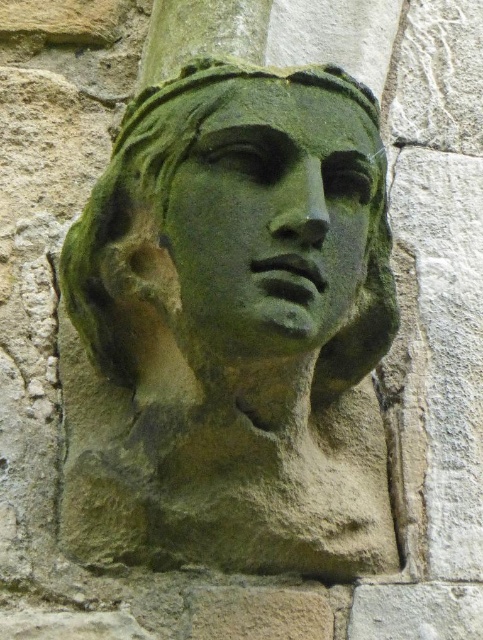
You are an archaeologist standing in front of a historical wall. You notice the green stone bust at center. Can you determine its exact coordinates on the wall?

The green stone bust at center is located at coordinates point (x=231, y=330).